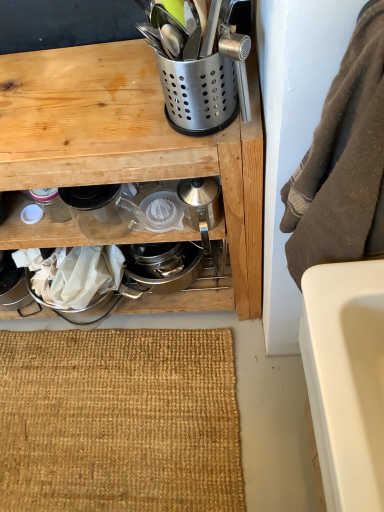
Where is `silver metallic kettle at center, which is the first appliance from right to left`? This screenshot has width=384, height=512. silver metallic kettle at center, which is the first appliance from right to left is located at coordinates (201, 201).

The width and height of the screenshot is (384, 512). Find the location of `metallic silver utensil holder at upper center`. metallic silver utensil holder at upper center is located at coordinates (132, 147).

The width and height of the screenshot is (384, 512). What are the coordinates of `matte glass jar at lower left, acting as the fifth appliance starting from the right` in the screenshot? It's located at (51, 204).

Find the location of `clear plastic juicer at center, the 3th appliance in the right-to-left sequence`. clear plastic juicer at center, the 3th appliance in the right-to-left sequence is located at coordinates (162, 211).

Locate an element on the screen. The image size is (384, 512). satin silver utensil holder at upper center, which ranks as the 4th appliance in left-to-right order is located at coordinates (201, 69).

Where is `silver metallic kettle at center, which is the first appliance from right to left`? silver metallic kettle at center, which is the first appliance from right to left is located at coordinates (201, 201).

Is burlap mat at lower center located outside metallic silver utensil holder at upper center?

Absolutely, burlap mat at lower center is external to metallic silver utensil holder at upper center.

Is burlap mat at lower center in front of or behind metallic silver utensil holder at upper center in the image?

burlap mat at lower center is positioned farther from the viewer than metallic silver utensil holder at upper center.

From a real-world perspective, is burlap mat at lower center positioned over metallic silver utensil holder at upper center based on gravity?

No, from a real-world perspective, burlap mat at lower center is not over metallic silver utensil holder at upper center

Who is shorter, burlap mat at lower center or metallic silver utensil holder at upper center?

burlap mat at lower center is shorter.

Considering the relative sizes of satin silver utensil holder at upper center, marked as the 2th appliance in a right-to-left arrangement, and burlap mat at lower center in the image provided, is satin silver utensil holder at upper center, marked as the 2th appliance in a right-to-left arrangement, wider than burlap mat at lower center?

No, satin silver utensil holder at upper center, marked as the 2th appliance in a right-to-left arrangement, is not wider than burlap mat at lower center.

How much distance is there between satin silver utensil holder at upper center, which ranks as the 4th appliance in left-to-right order, and burlap mat at lower center?

satin silver utensil holder at upper center, which ranks as the 4th appliance in left-to-right order, and burlap mat at lower center are 36.66 inches apart from each other.

From the image's perspective, is satin silver utensil holder at upper center, which ranks as the 4th appliance in left-to-right order, positioned above or below burlap mat at lower center?

Based on their image positions, satin silver utensil holder at upper center, which ranks as the 4th appliance in left-to-right order, is located above burlap mat at lower center.

Is there a large distance between satin silver utensil holder at upper center, which ranks as the 4th appliance in left-to-right order, and burlap mat at lower center?

That's not correct — satin silver utensil holder at upper center, which ranks as the 4th appliance in left-to-right order, is a little close to burlap mat at lower center.

How different are the orientations of satin silver utensil holder at upper center, which ranks as the 4th appliance in left-to-right order, and brown fuzzy towel at right in degrees?

There is a 3.23-degree angle between the facing directions of satin silver utensil holder at upper center, which ranks as the 4th appliance in left-to-right order, and brown fuzzy towel at right.

Is brown fuzzy towel at right located within satin silver utensil holder at upper center, which ranks as the 4th appliance in left-to-right order?

No.

Looking at the image, does satin silver utensil holder at upper center, which ranks as the 4th appliance in left-to-right order, seem bigger or smaller compared to brown fuzzy towel at right?

satin silver utensil holder at upper center, which ranks as the 4th appliance in left-to-right order, is smaller than brown fuzzy towel at right.

Is satin silver utensil holder at upper center, which ranks as the 4th appliance in left-to-right order, positioned with its back to brown fuzzy towel at right?

No, brown fuzzy towel at right is not at the back of satin silver utensil holder at upper center, which ranks as the 4th appliance in left-to-right order.

Considering the sizes of satin silver utensil holder at upper center, marked as the 2th appliance in a right-to-left arrangement, and matte glass jar at lower left, placed as the 1th appliance when sorted from left to right, in the image, is satin silver utensil holder at upper center, marked as the 2th appliance in a right-to-left arrangement, taller or shorter than matte glass jar at lower left, placed as the 1th appliance when sorted from left to right,?

Clearly, satin silver utensil holder at upper center, marked as the 2th appliance in a right-to-left arrangement, is taller compared to matte glass jar at lower left, placed as the 1th appliance when sorted from left to right.

Considering the relative sizes of satin silver utensil holder at upper center, marked as the 2th appliance in a right-to-left arrangement, and matte glass jar at lower left, acting as the fifth appliance starting from the right, in the image provided, is satin silver utensil holder at upper center, marked as the 2th appliance in a right-to-left arrangement, thinner than matte glass jar at lower left, acting as the fifth appliance starting from the right,?

Incorrect, the width of satin silver utensil holder at upper center, marked as the 2th appliance in a right-to-left arrangement, is not less than that of matte glass jar at lower left, acting as the fifth appliance starting from the right.

Is satin silver utensil holder at upper center, which ranks as the 4th appliance in left-to-right order, touching matte glass jar at lower left, placed as the 1th appliance when sorted from left to right?

No.

From a real-world perspective, is satin silver utensil holder at upper center, which ranks as the 4th appliance in left-to-right order, physically above matte glass jar at lower left, acting as the fifth appliance starting from the right?

Correct, in the physical world, satin silver utensil holder at upper center, which ranks as the 4th appliance in left-to-right order, is higher than matte glass jar at lower left, acting as the fifth appliance starting from the right.

Is brown fuzzy towel at right located within clear glass pitcher at center, arranged as the 2th appliance when viewed from the left?

That's incorrect, brown fuzzy towel at right is not inside clear glass pitcher at center, arranged as the 2th appliance when viewed from the left.

Between clear glass pitcher at center, the fourth appliance viewed from the right, and brown fuzzy towel at right, which one has larger size?

brown fuzzy towel at right.

From the picture: How different are the orientations of clear glass pitcher at center, arranged as the 2th appliance when viewed from the left, and brown fuzzy towel at right in degrees?

1.96 degrees separate the facing orientations of clear glass pitcher at center, arranged as the 2th appliance when viewed from the left, and brown fuzzy towel at right.

Is clear plastic juicer at center, acting as the 3th appliance starting from the left, situated inside clear glass pitcher at center, the fourth appliance viewed from the right, or outside?

The correct answer is: outside.

Between clear plastic juicer at center, acting as the 3th appliance starting from the left, and clear glass pitcher at center, the fourth appliance viewed from the right, which one has more height?

clear glass pitcher at center, the fourth appliance viewed from the right.

From the image's perspective, is silver metallic kettle at center, which is the first appliance from right to left, above matte glass jar at lower left, acting as the fifth appliance starting from the right?

No.

Based on the photo, how much distance is there between silver metallic kettle at center, which is the first appliance from right to left, and matte glass jar at lower left, acting as the fifth appliance starting from the right?

A distance of 12.42 inches exists between silver metallic kettle at center, which is the first appliance from right to left, and matte glass jar at lower left, acting as the fifth appliance starting from the right.

Does silver metallic kettle at center, which is the first appliance from right to left, appear on the left side of matte glass jar at lower left, placed as the 1th appliance when sorted from left to right?

In fact, silver metallic kettle at center, which is the first appliance from right to left, is to the right of matte glass jar at lower left, placed as the 1th appliance when sorted from left to right.

Between silver metallic kettle at center, marked as the fifth appliance in a left-to-right arrangement, and matte glass jar at lower left, acting as the fifth appliance starting from the right, which one has larger size?

silver metallic kettle at center, marked as the fifth appliance in a left-to-right arrangement.

Where is `doormat lying below the metallic silver utensil holder at upper center (from the image's perspective)`? This screenshot has width=384, height=512. doormat lying below the metallic silver utensil holder at upper center (from the image's perspective) is located at coordinates (119, 421).

Where is `doormat on the left side of satin silver utensil holder at upper center, which ranks as the 4th appliance in left-to-right order`? The height and width of the screenshot is (512, 384). doormat on the left side of satin silver utensil holder at upper center, which ranks as the 4th appliance in left-to-right order is located at coordinates (119, 421).

Looking at the image, which one is located further to clear plastic juicer at center, acting as the 3th appliance starting from the left, metallic silver utensil holder at upper center or silver metallic kettle at center, marked as the fifth appliance in a left-to-right arrangement?

metallic silver utensil holder at upper center is further to clear plastic juicer at center, acting as the 3th appliance starting from the left.

Looking at the image, which one is located further to clear glass pitcher at center, arranged as the 2th appliance when viewed from the left, brown fuzzy towel at right or clear plastic juicer at center, acting as the 3th appliance starting from the left?

Based on the image, brown fuzzy towel at right appears to be further to clear glass pitcher at center, arranged as the 2th appliance when viewed from the left.

Based on their spatial positions, is metallic silver utensil holder at upper center or satin silver utensil holder at upper center, which ranks as the 4th appliance in left-to-right order, closer to clear plastic juicer at center, acting as the 3th appliance starting from the left?

metallic silver utensil holder at upper center.

Which object lies nearer to the anchor point satin silver utensil holder at upper center, which ranks as the 4th appliance in left-to-right order, brown fuzzy towel at right or clear glass pitcher at center, arranged as the 2th appliance when viewed from the left?

The object closer to satin silver utensil holder at upper center, which ranks as the 4th appliance in left-to-right order, is brown fuzzy towel at right.

Which object lies further to the anchor point silver metallic kettle at center, which is the first appliance from right to left, brown fuzzy towel at right or burlap mat at lower center?

burlap mat at lower center.

Estimate the real-world distances between objects in this image. Which object is closer to metallic silver utensil holder at upper center, satin silver utensil holder at upper center, which ranks as the 4th appliance in left-to-right order, or brown fuzzy towel at right?

satin silver utensil holder at upper center, which ranks as the 4th appliance in left-to-right order.

Based on their spatial positions, is clear plastic juicer at center, the 3th appliance in the right-to-left sequence, or brown fuzzy towel at right closer to metallic silver utensil holder at upper center?

clear plastic juicer at center, the 3th appliance in the right-to-left sequence.

Looking at the image, which one is located closer to metallic silver utensil holder at upper center, brown fuzzy towel at right or matte glass jar at lower left, acting as the fifth appliance starting from the right?

matte glass jar at lower left, acting as the fifth appliance starting from the right.

Where is `cabinetry between clear glass pitcher at center, the fourth appliance viewed from the right, and burlap mat at lower center from top to bottom`? This screenshot has height=512, width=384. cabinetry between clear glass pitcher at center, the fourth appliance viewed from the right, and burlap mat at lower center from top to bottom is located at coordinates (132, 147).

Locate an element on the screen. This screenshot has width=384, height=512. cabinetry situated between matte glass jar at lower left, acting as the fifth appliance starting from the right, and clear plastic juicer at center, the 3th appliance in the right-to-left sequence, from left to right is located at coordinates (132, 147).

Where is `appliance that lies between clear glass pitcher at center, arranged as the 2th appliance when viewed from the left, and burlap mat at lower center from top to bottom`? appliance that lies between clear glass pitcher at center, arranged as the 2th appliance when viewed from the left, and burlap mat at lower center from top to bottom is located at coordinates (162, 211).

This screenshot has height=512, width=384. I want to click on cabinetry between brown fuzzy towel at right and clear plastic juicer at center, acting as the 3th appliance starting from the left, from front to back, so click(x=132, y=147).